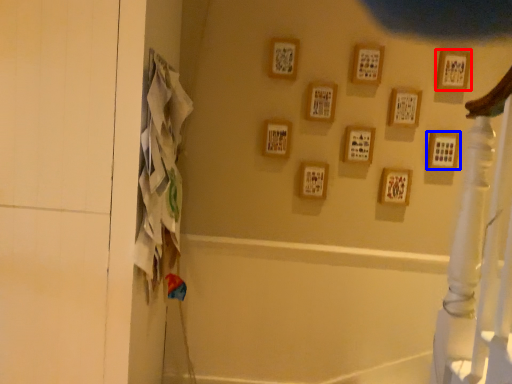
Question: Which of the following is the farthest to the observer, picture frame (highlighted by a red box) or picture frame (highlighted by a blue box)?

Choices:
 (A) picture frame
 (B) picture frame

Answer: (B)